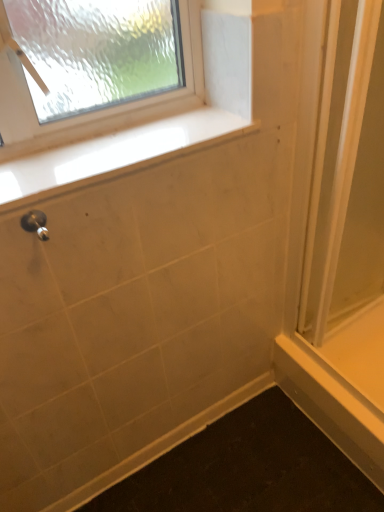
Question: Can you confirm if matte silver shower at lower left is shorter than clear plastic screen door at right?

Choices:
 (A) yes
 (B) no

Answer: (A)

Question: From the image's perspective, is matte silver shower at lower left above clear plastic screen door at right?

Choices:
 (A) no
 (B) yes

Answer: (A)

Question: Is matte silver shower at lower left positioned behind clear plastic screen door at right?

Choices:
 (A) yes
 (B) no

Answer: (B)

Question: Is matte silver shower at lower left positioned before clear plastic screen door at right?

Choices:
 (A) no
 (B) yes

Answer: (B)

Question: Considering the relative positions of matte silver shower at lower left and clear plastic screen door at right in the image provided, is matte silver shower at lower left to the right of clear plastic screen door at right from the viewer's perspective?

Choices:
 (A) yes
 (B) no

Answer: (B)

Question: Can you confirm if matte silver shower at lower left is thinner than clear plastic screen door at right?

Choices:
 (A) no
 (B) yes

Answer: (B)

Question: From the image's perspective, would you say white glossy window sill at upper center is positioned over clear plastic screen door at right?

Choices:
 (A) no
 (B) yes

Answer: (B)

Question: Can you confirm if white glossy window sill at upper center is taller than clear plastic screen door at right?

Choices:
 (A) yes
 (B) no

Answer: (B)

Question: Is white glossy window sill at upper center shorter than clear plastic screen door at right?

Choices:
 (A) no
 (B) yes

Answer: (B)

Question: Considering the relative sizes of white glossy window sill at upper center and clear plastic screen door at right in the image provided, is white glossy window sill at upper center wider than clear plastic screen door at right?

Choices:
 (A) yes
 (B) no

Answer: (A)

Question: Considering the relative sizes of white glossy window sill at upper center and clear plastic screen door at right in the image provided, is white glossy window sill at upper center smaller than clear plastic screen door at right?

Choices:
 (A) yes
 (B) no

Answer: (A)

Question: Is white glossy window sill at upper center to the left of clear plastic screen door at right from the viewer's perspective?

Choices:
 (A) no
 (B) yes

Answer: (B)

Question: Is clear plastic screen door at right to the right of matte silver shower at lower left from the viewer's perspective?

Choices:
 (A) yes
 (B) no

Answer: (A)